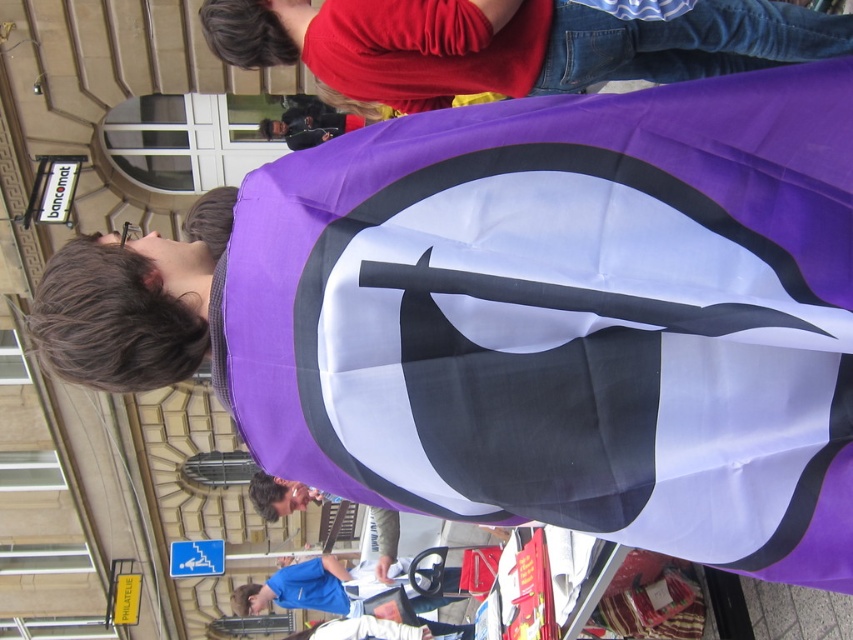
Question: Is purple fabric flag at center above purple fabric at upper center?

Choices:
 (A) yes
 (B) no

Answer: (B)

Question: Among these points, which one is farthest from the camera?

Choices:
 (A) (392, 404)
 (B) (596, 81)

Answer: (B)

Question: Can you confirm if purple fabric flag at center is positioned below purple fabric at upper center?

Choices:
 (A) no
 (B) yes

Answer: (B)

Question: Is purple fabric flag at center below purple fabric at upper center?

Choices:
 (A) no
 (B) yes

Answer: (B)

Question: Which point appears farthest from the camera in this image?

Choices:
 (A) (276, 412)
 (B) (209, 35)

Answer: (B)